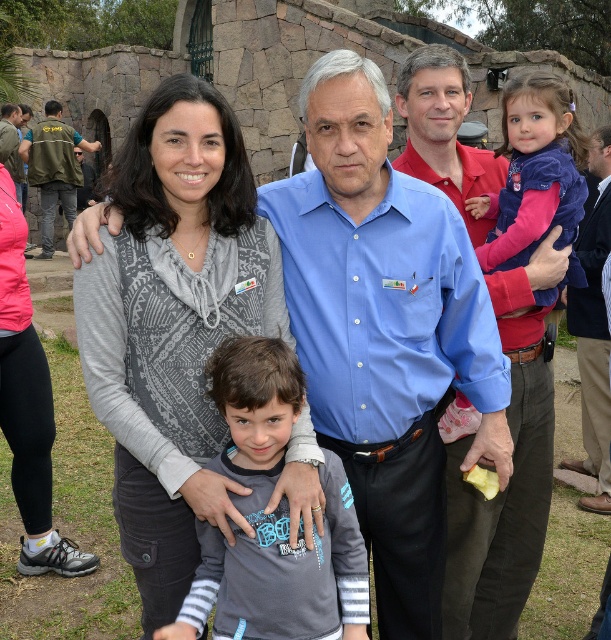
Does gray matte shirt at center have a greater width compared to dark brown leather shoes at lower right?

No.

Is point (213, 572) farther from camera compared to point (609, 236)?

No.

What are the coordinates of `gray matte shirt at center` in the screenshot? It's located at (273, 516).

Does purple fleece jacket at upper right have a larger size compared to dark brown leather shoes at lower right?

Incorrect, purple fleece jacket at upper right is not larger than dark brown leather shoes at lower right.

Looking at this image, is purple fleece jacket at upper right shorter than dark brown leather shoes at lower right?

Yes, purple fleece jacket at upper right is shorter than dark brown leather shoes at lower right.

Where is `purple fleece jacket at upper right`? purple fleece jacket at upper right is located at coordinates (533, 172).

Where is `purple fleece jacket at upper right`? purple fleece jacket at upper right is located at coordinates (533, 172).

This screenshot has height=640, width=611. What are the coordinates of `blue shirt at center` in the screenshot? It's located at (513, 472).

Who is more forward, (522, 378) or (282, 540)?

Positioned in front is point (282, 540).

Image resolution: width=611 pixels, height=640 pixels. I want to click on blue shirt at center, so click(513, 472).